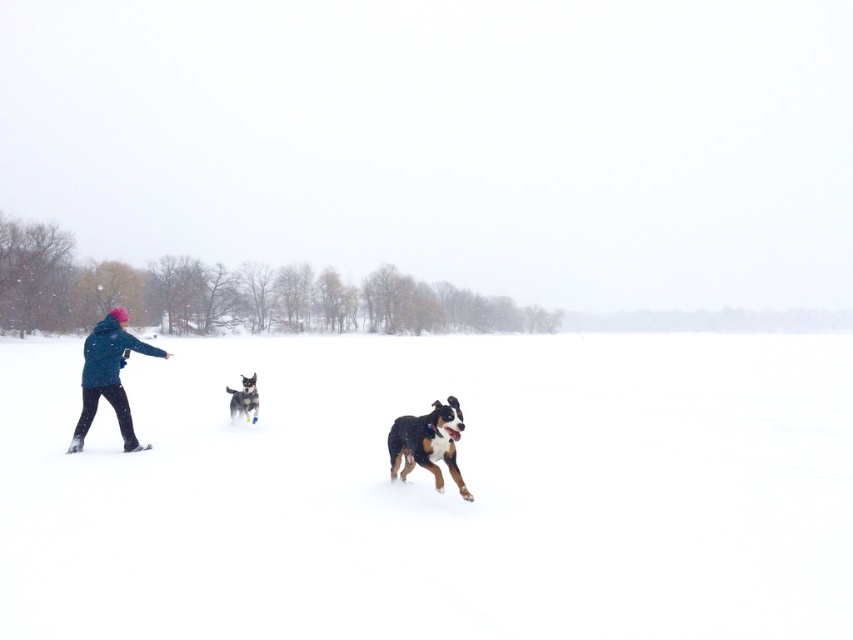
Question: Does white fluffy snow at center have a smaller size compared to black fur dog at center?

Choices:
 (A) yes
 (B) no

Answer: (B)

Question: Which of these objects is positioned farthest from the brown and white fur dog at center?

Choices:
 (A) blue fleece jacket at left
 (B) black fur dog at center
 (C) white fluffy snow at center

Answer: (C)

Question: Which is nearer to the brown and white fur dog at center?

Choices:
 (A) blue fleece jacket at left
 (B) white fluffy snow at center

Answer: (A)

Question: Is white fluffy snow at center in front of brown and white fur dog at center?

Choices:
 (A) no
 (B) yes

Answer: (B)

Question: Does blue fleece jacket at left have a greater width compared to black fur dog at center?

Choices:
 (A) no
 (B) yes

Answer: (A)

Question: Which of the following is the closest to the observer?

Choices:
 (A) black fur dog at center
 (B) white fluffy snow at center
 (C) blue fleece jacket at left

Answer: (B)